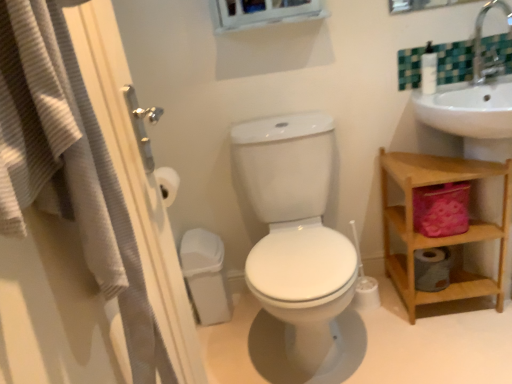
What do you see at coordinates (480, 45) in the screenshot?
I see `silver metallic faucet at upper right` at bounding box center [480, 45].

Describe the element at coordinates (296, 233) in the screenshot. This screenshot has width=512, height=384. I see `white glossy toilet at center` at that location.

The image size is (512, 384). Find the location of `silver metallic faucet at upper right`. silver metallic faucet at upper right is located at coordinates (480, 45).

From the image's perspective, which object appears higher, silver metallic faucet at upper right or white plastic soap dispenser at upper right?

silver metallic faucet at upper right is shown above in the image.

From a real-world perspective, who is located higher, silver metallic faucet at upper right or white plastic soap dispenser at upper right?

From a 3D spatial view, silver metallic faucet at upper right is above.

Looking at this image, between silver metallic faucet at upper right and white plastic soap dispenser at upper right, which one has smaller size?

Smaller between the two is white plastic soap dispenser at upper right.

Is silver metallic faucet at upper right positioned far away from white plastic soap dispenser at upper right?

Actually, silver metallic faucet at upper right and white plastic soap dispenser at upper right are a little close together.

Does wooden shelf at right have a lesser width compared to white plastic soap dispenser at upper right?

No.

Who is bigger, wooden shelf at right or white plastic soap dispenser at upper right?

wooden shelf at right.

From a real-world perspective, which is physically above, wooden shelf at right or white plastic soap dispenser at upper right?

white plastic soap dispenser at upper right is physically above.

Which is more to the right, wooden shelf at right or white plastic soap dispenser at upper right?

wooden shelf at right is more to the right.

Is white glossy toilet at center in front of white plastic soap dispenser at upper right?

Yes, white glossy toilet at center is closer to the camera.

Would you say white glossy toilet at center is a long distance from white plastic soap dispenser at upper right?

No, there isn't a large distance between white glossy toilet at center and white plastic soap dispenser at upper right.

In the scene shown: How different are the orientations of white glossy toilet at center and white plastic soap dispenser at upper right in degrees?

The facing directions of white glossy toilet at center and white plastic soap dispenser at upper right are 0.396 degrees apart.

Is white glossy toilet at center oriented towards white plastic soap dispenser at upper right?

No, white glossy toilet at center is not oriented towards white plastic soap dispenser at upper right.

Does silver metallic faucet at upper right have a larger size compared to wooden shelf at right?

Actually, silver metallic faucet at upper right might be smaller than wooden shelf at right.

Considering the relative sizes of silver metallic faucet at upper right and wooden shelf at right in the image provided, is silver metallic faucet at upper right shorter than wooden shelf at right?

Correct, silver metallic faucet at upper right is not as tall as wooden shelf at right.

Does silver metallic faucet at upper right appear on the left side of wooden shelf at right?

In fact, silver metallic faucet at upper right is to the right of wooden shelf at right.

Is point (481, 80) farther from viewer compared to point (396, 166)?

Yes.

Does white textured screen door at left have a smaller size compared to silver metallic faucet at upper right?

Incorrect, white textured screen door at left is not smaller in size than silver metallic faucet at upper right.

From the picture: Considering the relative positions of white textured screen door at left and silver metallic faucet at upper right in the image provided, is white textured screen door at left to the right of silver metallic faucet at upper right from the viewer's perspective?

In fact, white textured screen door at left is to the left of silver metallic faucet at upper right.

How different are the orientations of white textured screen door at left and silver metallic faucet at upper right in degrees?

There is a 86.6-degree angle between the facing directions of white textured screen door at left and silver metallic faucet at upper right.

Would you say white textured screen door at left is inside or outside silver metallic faucet at upper right?

white textured screen door at left is not enclosed by silver metallic faucet at upper right.

From the image's perspective, is white glossy toilet at center positioned above or below white textured screen door at left?

white glossy toilet at center is below white textured screen door at left.

From a real-world perspective, which is physically above, white glossy toilet at center or white textured screen door at left?

white textured screen door at left, from a real-world perspective.

Considering the relative sizes of white glossy toilet at center and white textured screen door at left in the image provided, is white glossy toilet at center wider than white textured screen door at left?

Yes, white glossy toilet at center is wider than white textured screen door at left.

From the image's perspective, which is below, white plastic soap dispenser at upper right or white glossy toilet at center?

white glossy toilet at center appears lower in the image.

Relative to white glossy toilet at center, is white plastic soap dispenser at upper right in front or behind?

In the image, white plastic soap dispenser at upper right appears behind white glossy toilet at center.

Is point (423, 54) farther from viewer compared to point (297, 357)?

Yes, point (423, 54) is behind point (297, 357).

Considering the sizes of objects white plastic soap dispenser at upper right and white glossy toilet at center in the image provided, who is smaller, white plastic soap dispenser at upper right or white glossy toilet at center?

With smaller size is white plastic soap dispenser at upper right.

The image size is (512, 384). In order to click on soap dispenser located underneath the silver metallic faucet at upper right (from a real-world perspective) in this screenshot , I will do `click(428, 70)`.

Where is `soap dispenser above the wooden shelf at right (from a real-world perspective)`? This screenshot has width=512, height=384. soap dispenser above the wooden shelf at right (from a real-world perspective) is located at coordinates (428, 70).

Which object lies further to the anchor point silver metallic faucet at upper right, wooden shelf at right or white textured screen door at left?

Based on the image, white textured screen door at left appears to be further to silver metallic faucet at upper right.

Estimate the real-world distances between objects in this image. Which object is further from white glossy toilet at center, white plastic soap dispenser at upper right or silver metallic faucet at upper right?

Based on the image, silver metallic faucet at upper right appears to be further to white glossy toilet at center.

From the image, which object appears to be nearer to silver metallic faucet at upper right, white plastic soap dispenser at upper right or white glossy toilet at center?

Among the two, white plastic soap dispenser at upper right is located nearer to silver metallic faucet at upper right.

Estimate the real-world distances between objects in this image. Which object is further from white plastic soap dispenser at upper right, white glossy toilet at center or silver metallic faucet at upper right?

white glossy toilet at center.

From the image, which object appears to be nearer to white textured screen door at left, wooden shelf at right or silver metallic faucet at upper right?

wooden shelf at right is positioned closer to the anchor white textured screen door at left.

Estimate the real-world distances between objects in this image. Which object is further from white glossy toilet at center, silver metallic faucet at upper right or white plastic soap dispenser at upper right?

The object further to white glossy toilet at center is silver metallic faucet at upper right.

When comparing their distances from silver metallic faucet at upper right, does white plastic soap dispenser at upper right or wooden shelf at right seem further?

Based on the image, wooden shelf at right appears to be further to silver metallic faucet at upper right.

Estimate the real-world distances between objects in this image. Which object is closer to white textured screen door at left, wooden shelf at right or white plastic soap dispenser at upper right?

wooden shelf at right lies closer to white textured screen door at left than the other object.

The image size is (512, 384). What are the coordinates of `toilet between white textured screen door at left and silver metallic faucet at upper right from left to right` in the screenshot? It's located at (296, 233).

Image resolution: width=512 pixels, height=384 pixels. Find the location of `toilet between white textured screen door at left and wooden shelf at right along the z-axis`. toilet between white textured screen door at left and wooden shelf at right along the z-axis is located at coordinates (296, 233).

This screenshot has width=512, height=384. I want to click on shelf between white textured screen door at left and white plastic soap dispenser at upper right from front to back, so click(441, 237).

You are a GUI agent. You are given a task and a screenshot of the screen. Output one action in this format:
    pyautogui.click(x=<x>, y=<y>)
    Task: Click on the toilet between white textured screen door at left and white plastic soap dispenser at upper right along the z-axis
    This screenshot has height=384, width=512.
    Given the screenshot: What is the action you would take?
    pyautogui.click(x=296, y=233)